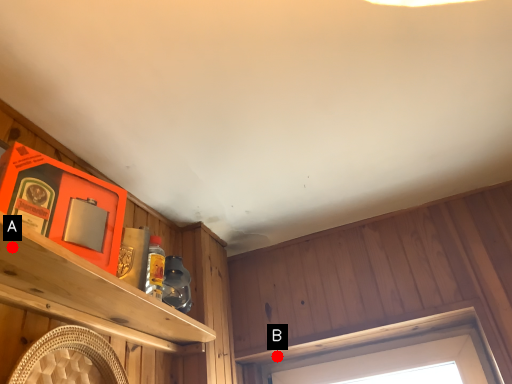
Question: Two points are circled on the image, labeled by A and B beside each circle. Which point is closer to the camera?

Choices:
 (A) A is closer
 (B) B is closer

Answer: (A)